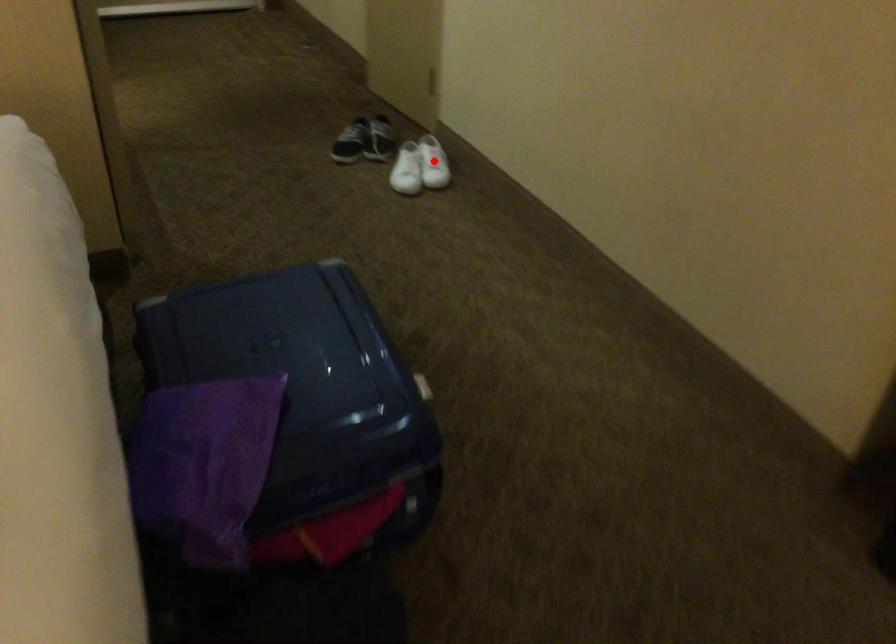
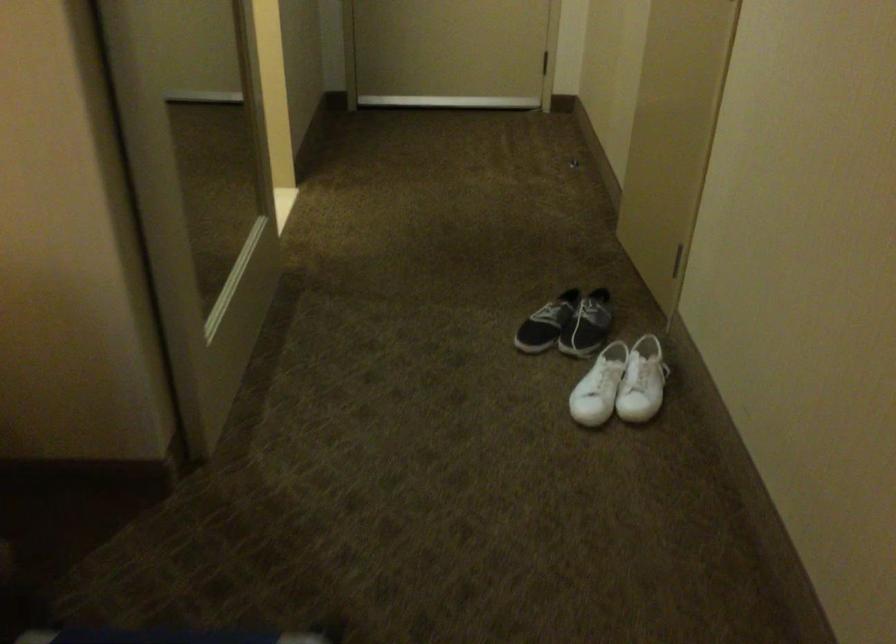
Question: I am providing you with two images of the same scene from different viewpoints. A red point is shown in image1. For the corresponding object point in image2, is it positioned nearer or farther from the camera?

Choices:
 (A) Nearer
 (B) Farther

Answer: (A)